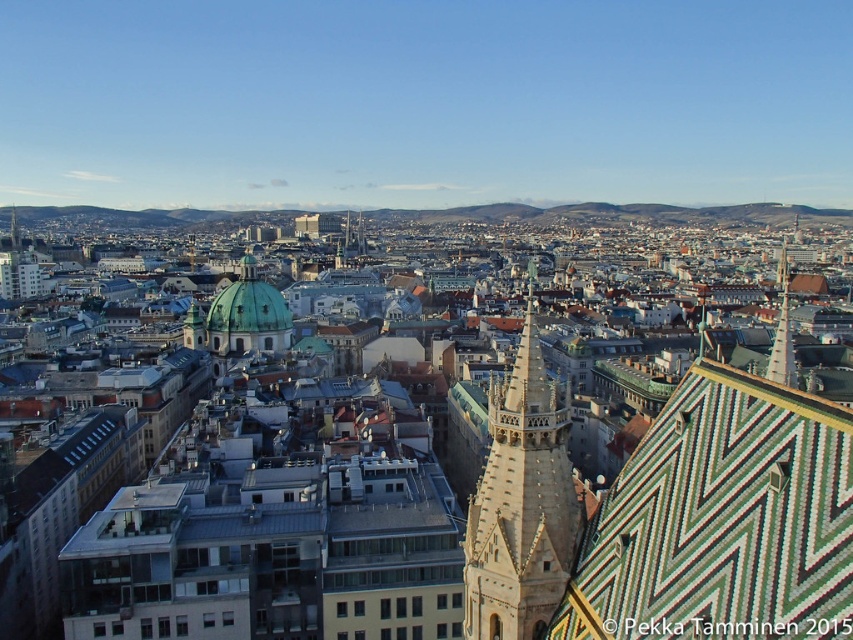
Question: Can you confirm if light brown stone tower at center is positioned above green glazed tile spire at upper right?

Choices:
 (A) yes
 (B) no

Answer: (B)

Question: Which point is farther to the camera?

Choices:
 (A) light brown stone tower at center
 (B) green mosaic tile roof at upper right
 (C) green glazed tile spire at upper right

Answer: (C)

Question: Where is green mosaic tile roof at upper right located in relation to green glazed tile spire at upper right in the image?

Choices:
 (A) below
 (B) above

Answer: (A)

Question: Which of these objects is positioned farthest from the light brown stone tower at center?

Choices:
 (A) green glazed tile spire at upper right
 (B) green mosaic tile roof at upper right

Answer: (A)

Question: Which of these objects is positioned farthest from the green mosaic tile roof at upper right?

Choices:
 (A) light brown stone tower at center
 (B) green glazed tile spire at upper right

Answer: (B)

Question: In this image, where is light brown stone tower at center located relative to green glazed tile spire at upper right?

Choices:
 (A) left
 (B) right

Answer: (A)